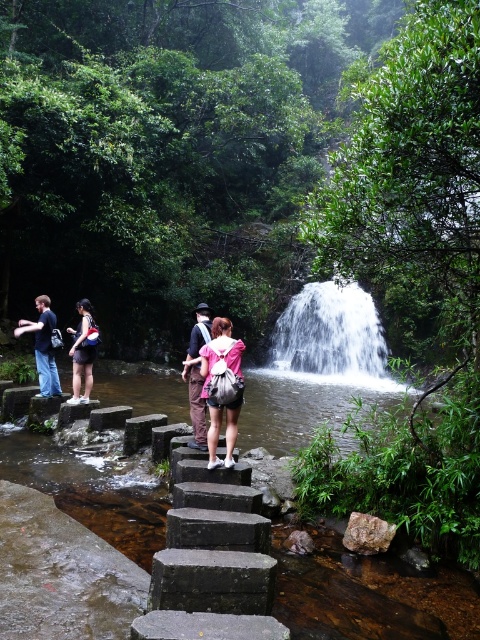
You are a hiker carrying a pink fabric backpack at center and wearing dark blue jeans at left. You need to climb down the stone steps towards the waterfall. Considering the size of your backpack and your jeans, which item might make it harder to maneuver on the narrow steps?

The pink fabric backpack at center is wider than the dark blue jeans at left, so it might make it harder to maneuver on the narrow steps.

Looking at this image, you are a hiker carrying a heavy load and need to rest. You see the pink fabric backpack at center and the dark blue jeans at left. If you want to place your backpack on the ground between them, will there be enough space?

The distance between the pink fabric backpack at center and the dark blue jeans at left is 4.76 meters, so there is sufficient space to place your backpack between them.

You are a hiker planning to climb the stone steps towards the waterfall. You notice a pink fabric backpack at center and dark blue jeans at left. Which item is larger in size?

The pink fabric backpack at center is bigger than the dark blue jeans at left.